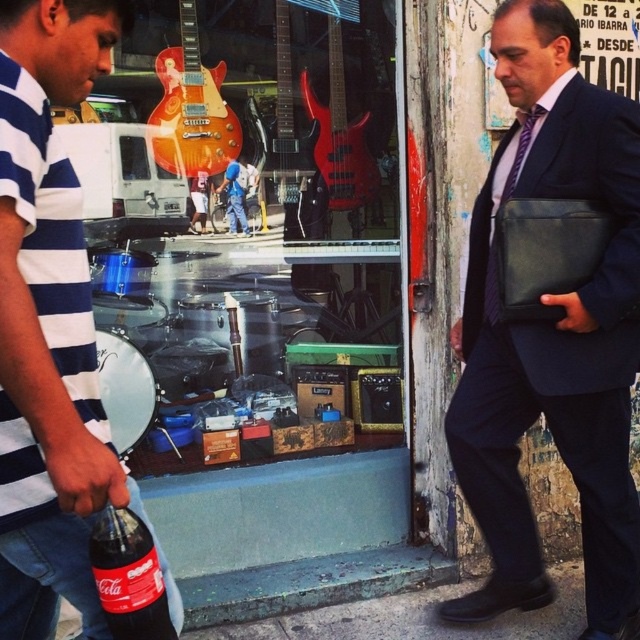
You are a delivery person who needs to place a package between the matte black briefcase at center and the striped cotton shirt at left. Based on the scene, where should you position the package?

The matte black briefcase at center is to the right of the striped cotton shirt at left, so you should place the package to the right of the striped cotton shirt at left and to the left of the matte black briefcase at center.

You are a delivery person who needs to place a heavy package on the ground. You see the matte black briefcase at center and the green concrete pavement at lower center. Which surface is suitable for placing the heavy package?

The green concrete pavement at lower center is suitable for placing the heavy package because the matte black briefcase at center is in front of it and likely belongs to someone.